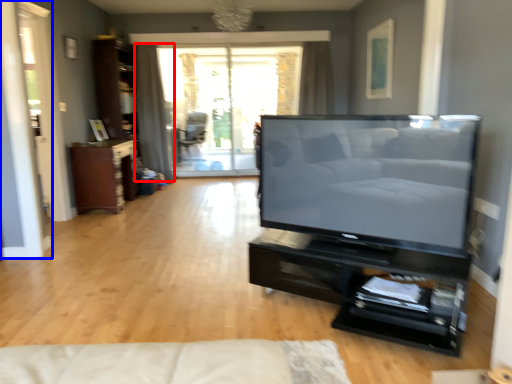
Question: Which of the following is the closest to the observer, curtain (highlighted by a red box) or screen door (highlighted by a blue box)?

Choices:
 (A) curtain
 (B) screen door

Answer: (B)